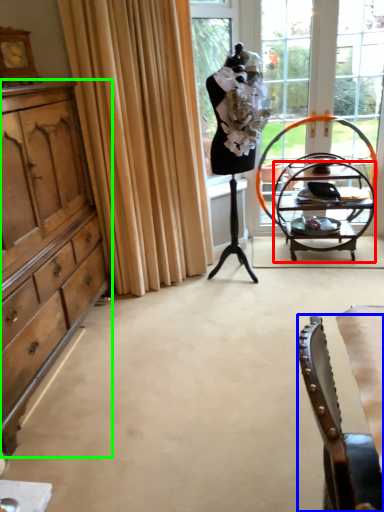
Question: Based on their relative distances, which object is farther from desk (highlighted by a red box)? Choose from chair (highlighted by a blue box) and cabinetry (highlighted by a green box).

Choices:
 (A) chair
 (B) cabinetry

Answer: (A)